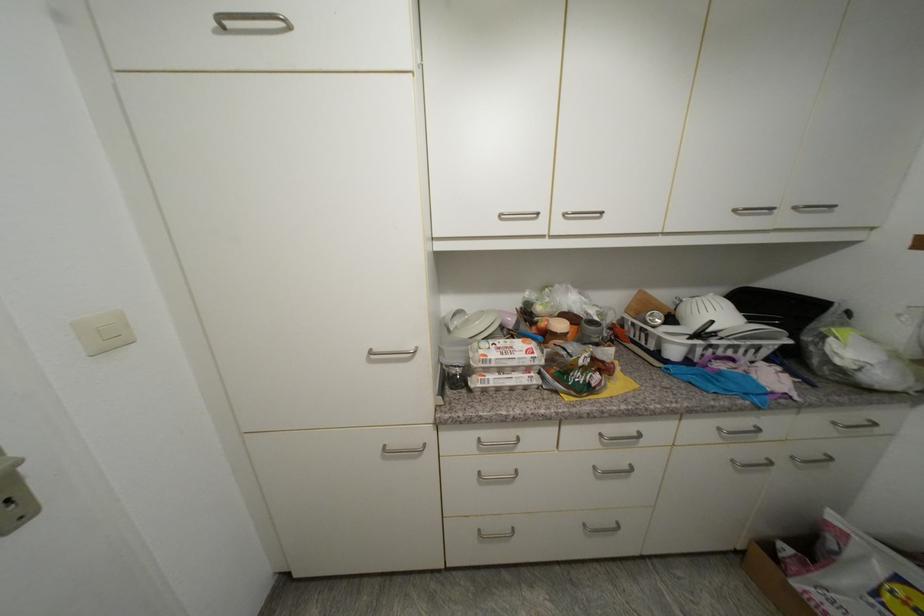
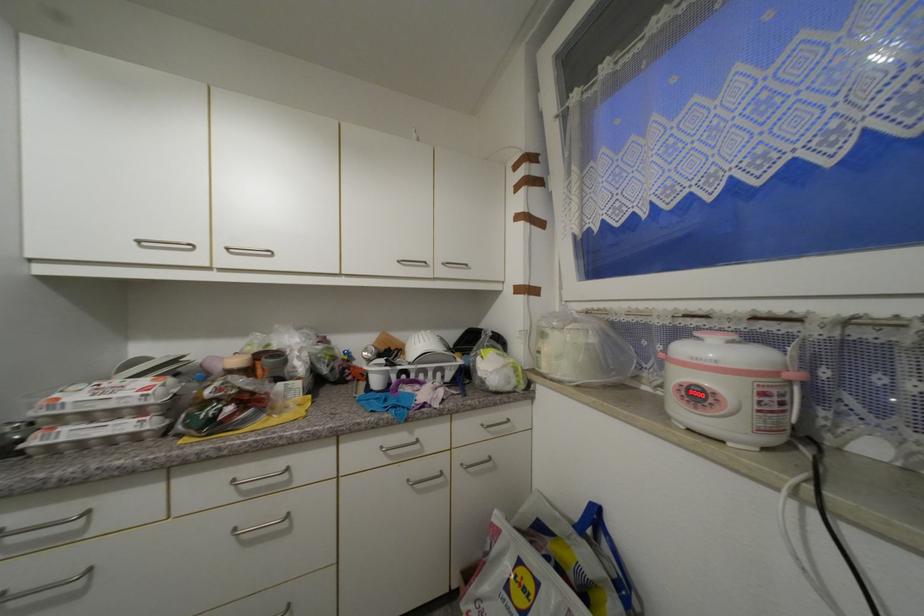
The first image is from the beginning of the video and the second image is from the end. How did the camera likely rotate when shooting the video?

The camera rotated toward right-up.